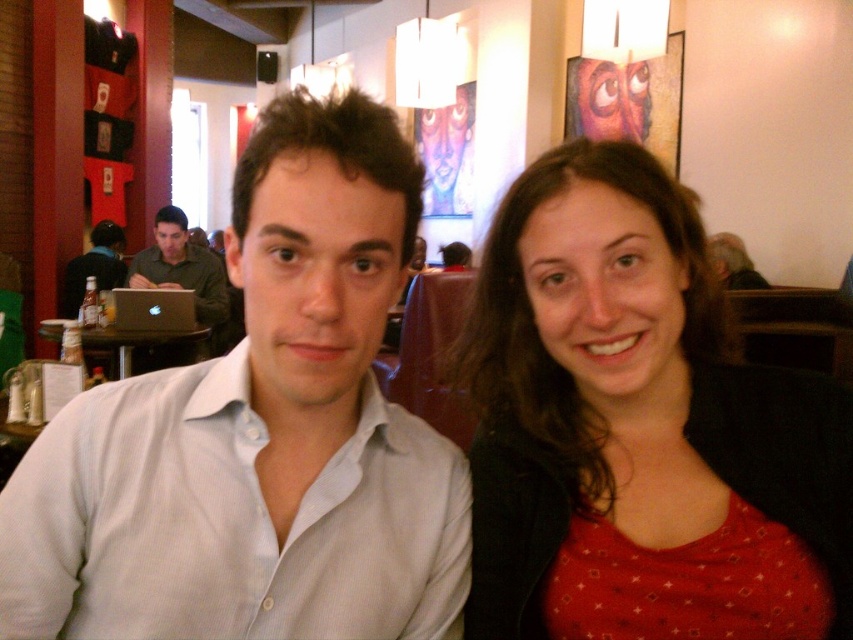
You are a photographer trying to capture a group photo of the people in the scene. You notice the green matte shirt at left and the black plastic table at left. Which object is narrower in width?

The green matte shirt at left is narrower in width than the black plastic table at left according to the description.

You are standing in the cafe and want to determine which of the two points, point (45, 602) or point (88, 332), is nearer to you. Based on the scene description, which point is closer?

Point (45, 602) is closer to the viewer than point (88, 332) according to the description.